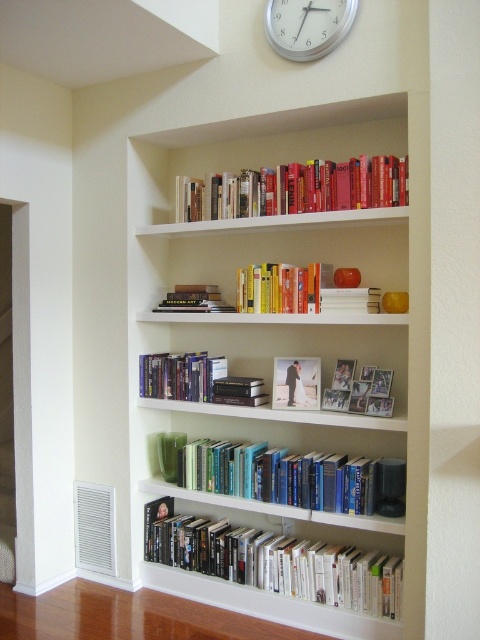
Between hardcover books at center and silver metallic clock at upper center, which one appears on the left side from the viewer's perspective?

From the viewer's perspective, hardcover books at center appears more on the left side.

Can you confirm if hardcover books at center is taller than silver metallic clock at upper center?

Incorrect, hardcover books at center's height is not larger of silver metallic clock at upper center's.

Which is in front, point (144, 385) or point (296, 44)?

Positioned in front is point (296, 44).

Where is `hardcover books at center`? The image size is (480, 640). hardcover books at center is located at coordinates (196, 380).

Is the position of white glossy book at lower center more distant than that of hardcover books at upper center?

That is True.

Describe the element at coordinates (275, 561) in the screenshot. I see `white glossy book at lower center` at that location.

The height and width of the screenshot is (640, 480). What are the coordinates of `white glossy book at lower center` in the screenshot? It's located at (275, 561).

The width and height of the screenshot is (480, 640). I want to click on white glossy book at lower center, so click(x=275, y=561).

Between white glossy book at lower center and hardcover books at center, which one is positioned higher?

hardcover books at center is above.

Between point (305, 563) and point (156, 362), which one is positioned in front?

Positioned in front is point (305, 563).

Is point (344, 552) closer to viewer compared to point (160, 396)?

Yes, point (344, 552) is in front of point (160, 396).

Locate an element on the screen. The image size is (480, 640). white glossy book at lower center is located at coordinates (275, 561).